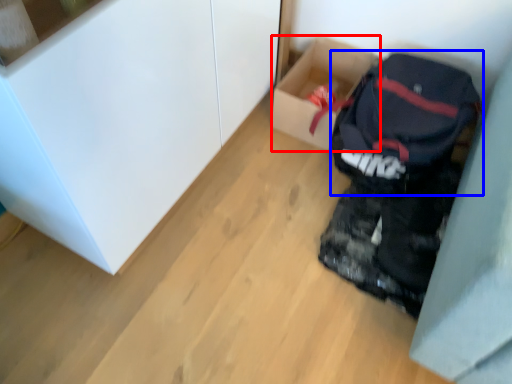
Question: Which of the following is the farthest to the observer, box (highlighted by a red box) or backpack (highlighted by a blue box)?

Choices:
 (A) box
 (B) backpack

Answer: (A)